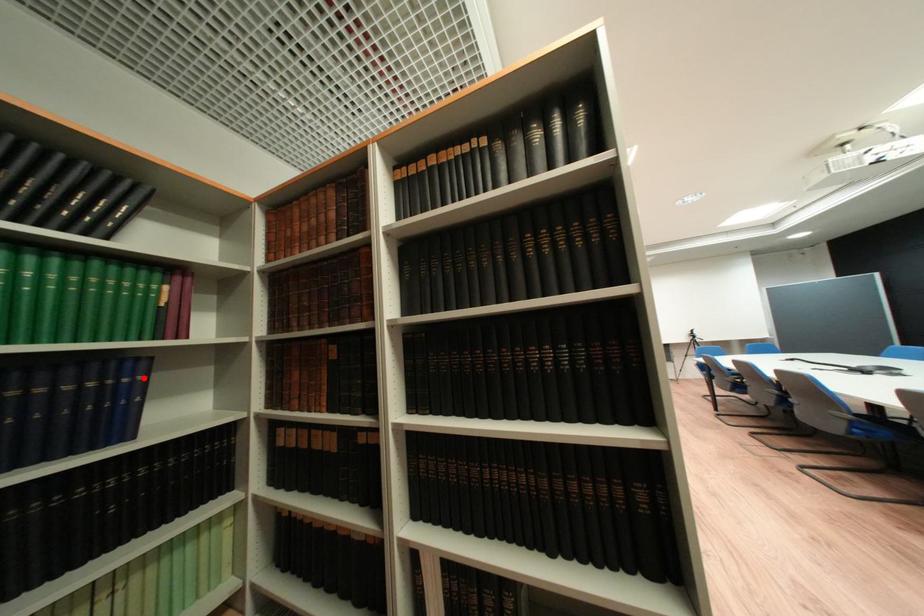
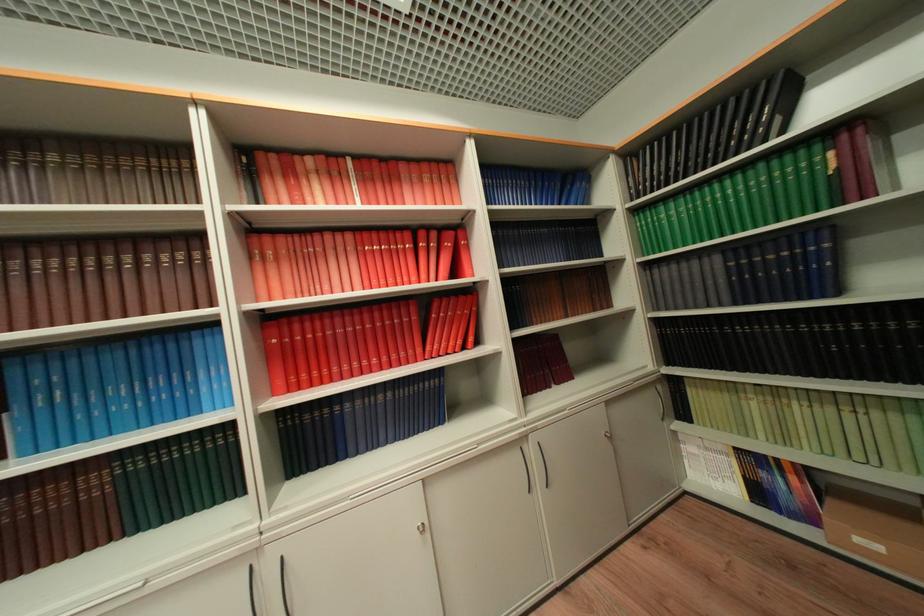
Find the pixel in the second image that matches the highlighted location in the first image.

(829, 246)